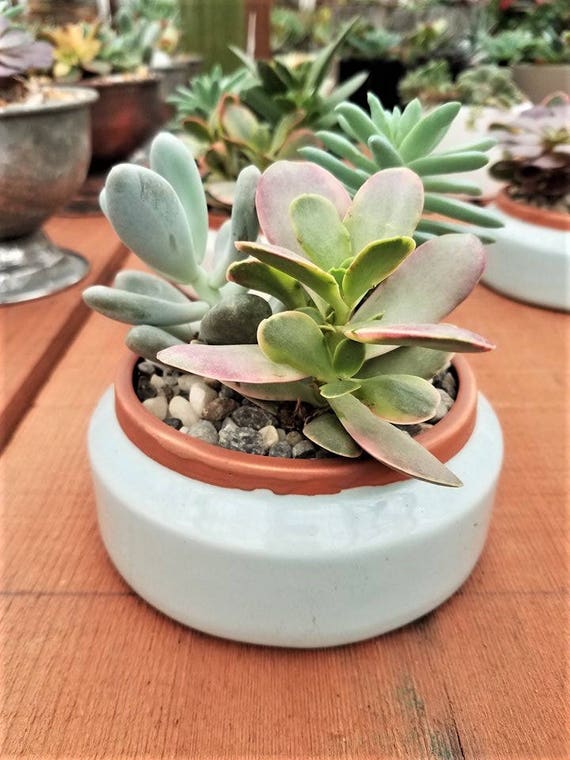
This screenshot has height=760, width=570. I want to click on white pot, so click(296, 532), click(540, 249).